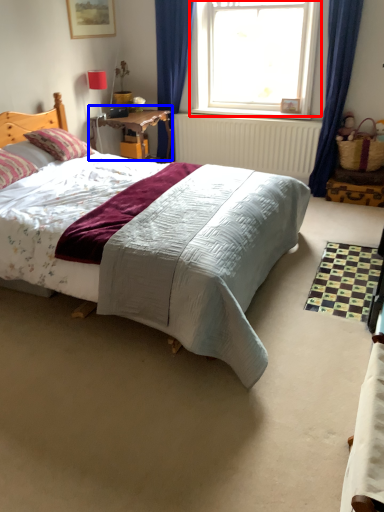
Question: Which of the following is the closest to the observer, window (highlighted by a red box) or table (highlighted by a blue box)?

Choices:
 (A) window
 (B) table

Answer: (A)